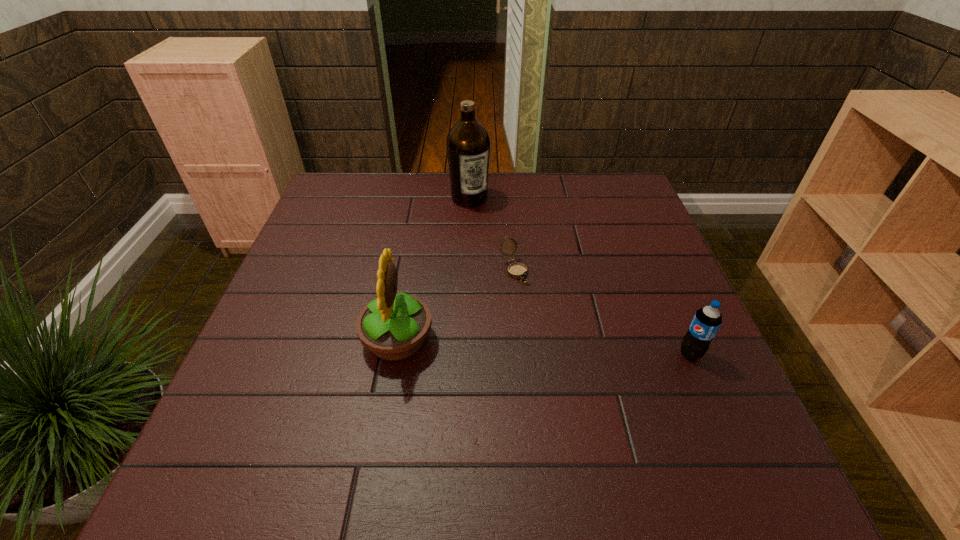
Where is `sunflower`? This screenshot has height=540, width=960. sunflower is located at coordinates (394, 326).

Find the location of a particular element. the leftmost object is located at coordinates (394, 326).

The height and width of the screenshot is (540, 960). I want to click on soda bottle, so click(706, 322).

Where is `the second shortest object`? The image size is (960, 540). the second shortest object is located at coordinates (706, 322).

I want to click on the tallest object, so click(x=468, y=143).

Where is `olive oil`? olive oil is located at coordinates (468, 143).

Image resolution: width=960 pixels, height=540 pixels. Identify the location of compass. (516, 270).

The width and height of the screenshot is (960, 540). Find the location of `the shortest object`. the shortest object is located at coordinates (516, 270).

Identify the location of vacant position located on the face of the second tallest object. (567, 340).

At what (x,y) coordinates should I click in order to perform the action: click on vacant space located on the back of the rightmost object. Please return your answer as a coordinate pair (x, y). Image resolution: width=960 pixels, height=540 pixels. Looking at the image, I should click on (649, 256).